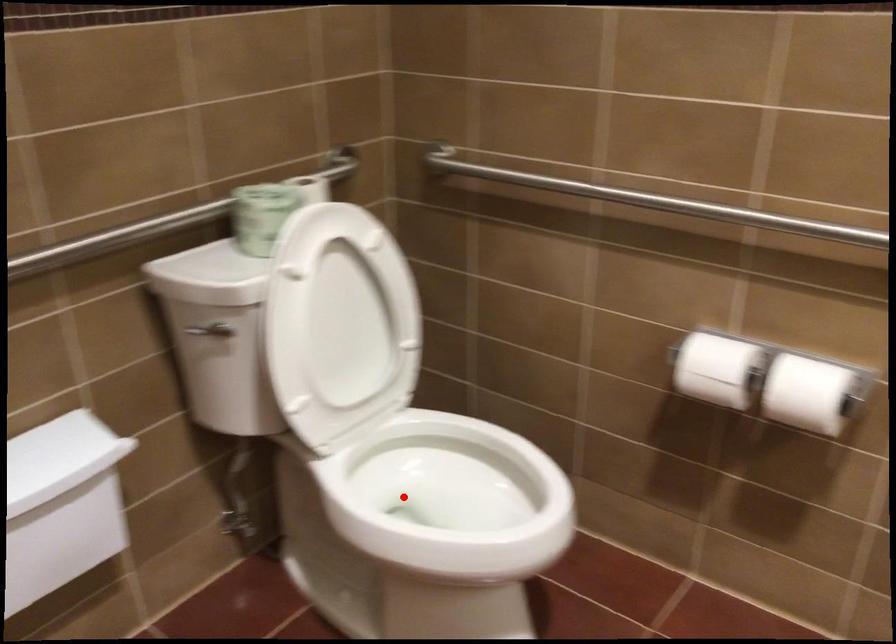
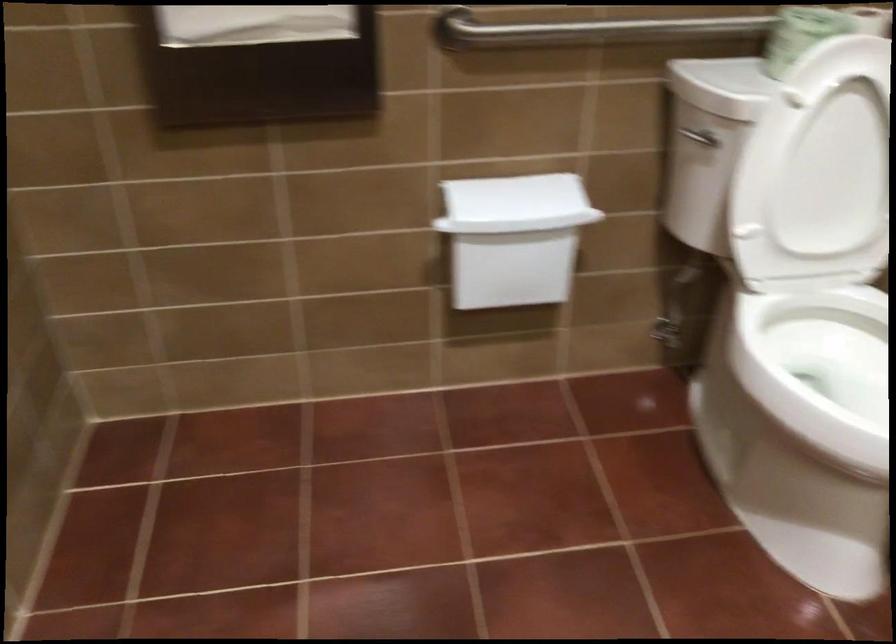
Find the pixel in the second image that matches the highlighted location in the first image.

(819, 368)